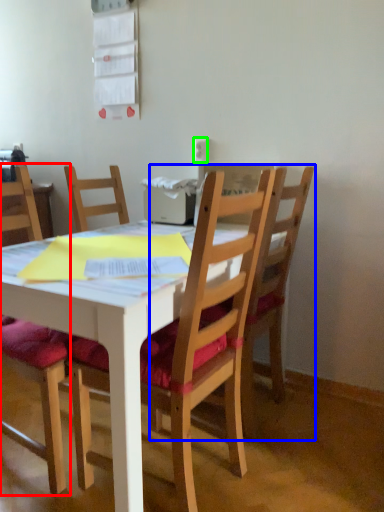
Question: Estimate the real-world distances between objects in this image. Which object is closer to chair (highlighted by a red box), chair (highlighted by a blue box) or power outlet (highlighted by a green box)?

Choices:
 (A) chair
 (B) power outlet

Answer: (A)